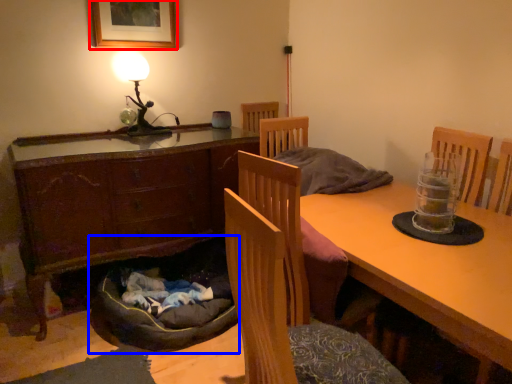
Question: Which of the following is the closest to the observer, picture frame (highlighted by a red box) or dog bed (highlighted by a blue box)?

Choices:
 (A) picture frame
 (B) dog bed

Answer: (B)